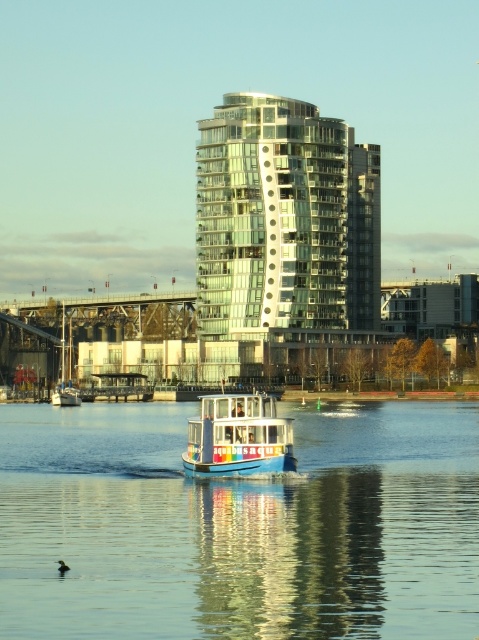
Image resolution: width=479 pixels, height=640 pixels. Describe the element at coordinates (239, 528) in the screenshot. I see `blue glossy water at center` at that location.

Who is more forward, (161, 538) or (212, 304)?

Point (161, 538) is more forward.

Does point (182, 493) lie in front of point (239, 92)?

Yes.

The height and width of the screenshot is (640, 479). I want to click on blue glossy water at center, so click(x=239, y=528).

Is blue painted wooden boat at center thinner than white glossy sailboat at left?

Yes.

Can you confirm if blue painted wooden boat at center is shorter than white glossy sailboat at left?

Correct, blue painted wooden boat at center is not as tall as white glossy sailboat at left.

The height and width of the screenshot is (640, 479). What are the coordinates of `blue painted wooden boat at center` in the screenshot? It's located at (239, 436).

You are a GUI agent. You are given a task and a screenshot of the screen. Output one action in this format:
    pyautogui.click(x=<x>, y=<y>)
    Task: Click on the blue painted wooden boat at center
    
    Given the screenshot: What is the action you would take?
    coord(239,436)

Find the location of a particular element. Image resolution: width=479 pixels, height=640 pixels. glassy reflective building at center is located at coordinates (285, 228).

In the scene shown: Is glassy reflective building at center to the left of blue painted wooden boat at center from the viewer's perspective?

Incorrect, glassy reflective building at center is not on the left side of blue painted wooden boat at center.

At what (x,y) coordinates should I click in order to perform the action: click on glassy reflective building at center. Please return your answer as a coordinate pair (x, y). Image resolution: width=479 pixels, height=640 pixels. Looking at the image, I should click on (285, 228).

Identify the location of glassy reflective building at center. This screenshot has height=640, width=479. (285, 228).